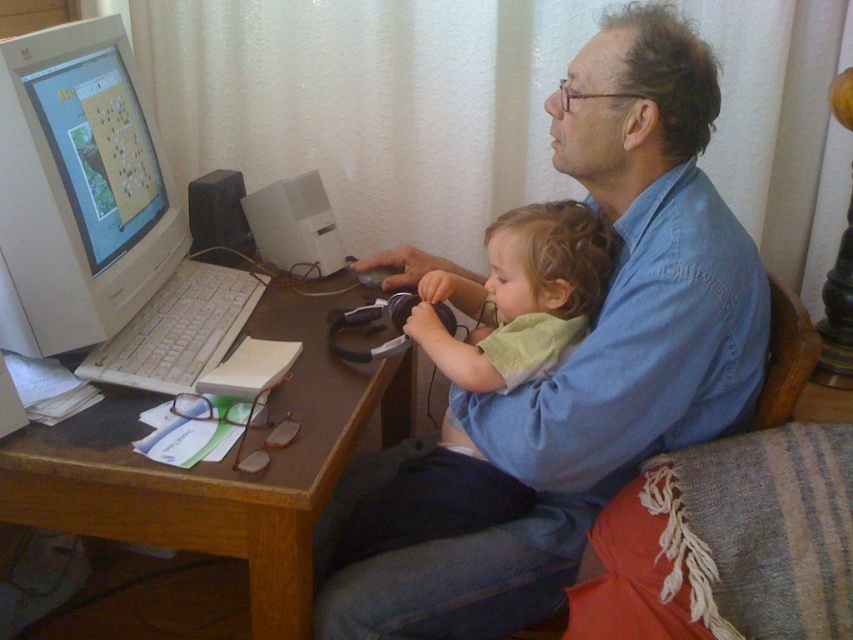
Question: Which object is farther from the camera taking this photo?

Choices:
 (A) green matte shirt at upper center
 (B) blue cotton shirt at upper right

Answer: (A)

Question: Is white wood computer desk at center positioned in front of light green fabric baby at center?

Choices:
 (A) yes
 (B) no

Answer: (A)

Question: Among these points, which one is nearest to the camera?

Choices:
 (A) (42, 324)
 (B) (727, 396)

Answer: (A)

Question: Can you confirm if blue cotton shirt at upper right is positioned below white glossy computer monitor at left?

Choices:
 (A) yes
 (B) no

Answer: (A)

Question: Estimate the real-world distances between objects in this image. Which object is closer to the light green fabric baby at center?

Choices:
 (A) blue cotton shirt at upper right
 (B) white wood computer desk at center

Answer: (A)

Question: Can you confirm if blue cotton shirt at upper right is positioned to the left of white glossy computer monitor at left?

Choices:
 (A) no
 (B) yes

Answer: (A)